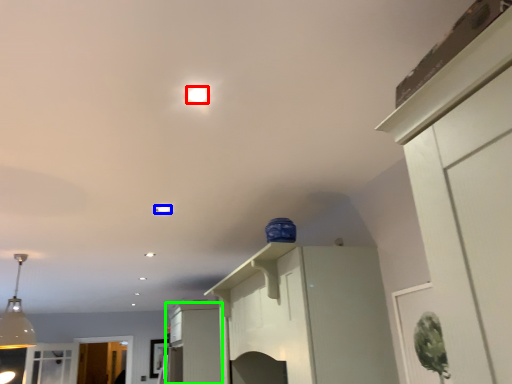
Question: Which object is positioned farthest from lighting (highlighted by a red box)? Select from light (highlighted by a blue box) and cabinetry (highlighted by a green box).

Choices:
 (A) light
 (B) cabinetry

Answer: (B)